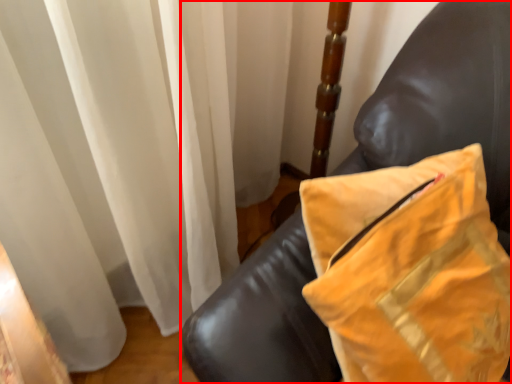
Question: From the image's perspective, where is furniture (annotated by the red box) located in relation to pillow in the image?

Choices:
 (A) above
 (B) below

Answer: (A)